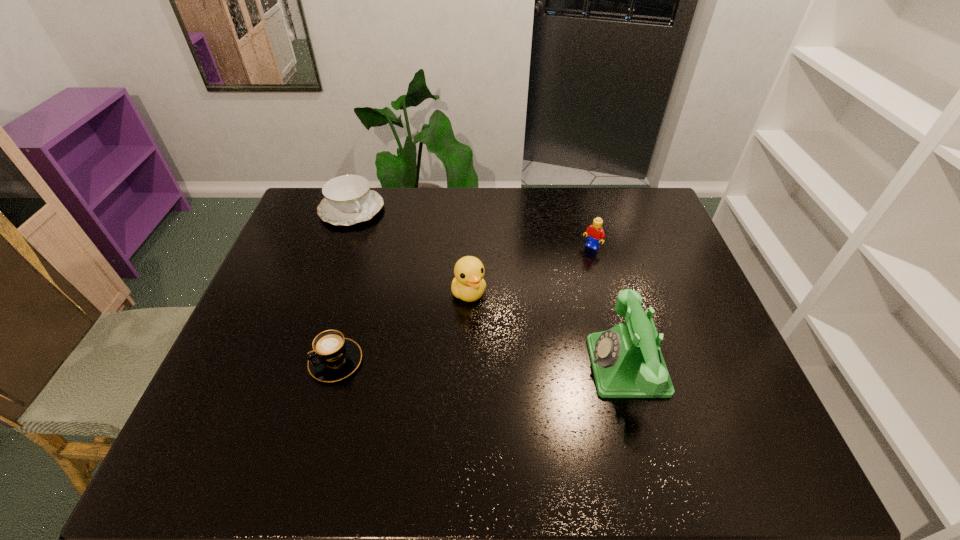
Find the location of a particular element. the second closest object to the chinaware is located at coordinates (333, 358).

Where is `free space that satisfies the following two spatial constraints: 1. on the back side of the cappuccino; 2. on the left side of the Lego`? This screenshot has height=540, width=960. free space that satisfies the following two spatial constraints: 1. on the back side of the cappuccino; 2. on the left side of the Lego is located at coordinates (366, 248).

This screenshot has height=540, width=960. In order to click on free space that satisfies the following two spatial constraints: 1. on the back side of the cappuccino; 2. on the right side of the Lego in this screenshot , I will do click(x=366, y=248).

Find the location of a particular element. Image resolution: width=960 pixels, height=540 pixels. free space that satisfies the following two spatial constraints: 1. on the front side of the tallest object; 2. on the dial of the third object from left to right is located at coordinates (468, 366).

Find the location of a particular element. This screenshot has height=540, width=960. blank area in the image that satisfies the following two spatial constraints: 1. on the front side of the second tallest object; 2. on the dial of the tallest object is located at coordinates (468, 366).